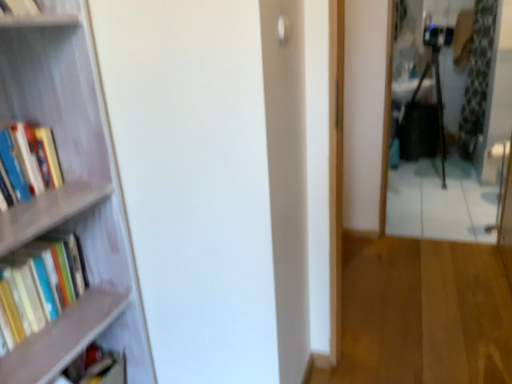
Question: From the image's perspective, is wooden bookshelf at left on top of hardcover books at left, which ranks as the 2th book in top-to-bottom order?

Choices:
 (A) yes
 (B) no

Answer: (A)

Question: Is wooden bookshelf at left facing towards hardcover books at left, which is the 2th book from bottom to top?

Choices:
 (A) no
 (B) yes

Answer: (B)

Question: Does wooden bookshelf at left have a larger size compared to hardcover books at left, which ranks as the 2th book in top-to-bottom order?

Choices:
 (A) no
 (B) yes

Answer: (B)

Question: Considering the relative sizes of wooden bookshelf at left and hardcover books at left, which ranks as the 2th book in top-to-bottom order, in the image provided, is wooden bookshelf at left wider than hardcover books at left, which ranks as the 2th book in top-to-bottom order,?

Choices:
 (A) yes
 (B) no

Answer: (A)

Question: Is wooden bookshelf at left far from hardcover books at left, which ranks as the 2th book in top-to-bottom order?

Choices:
 (A) yes
 (B) no

Answer: (B)

Question: Is wooden bookshelf at left shorter than hardcover books at left, which is the 2th book from bottom to top?

Choices:
 (A) yes
 (B) no

Answer: (B)

Question: Does metallic reflective mirror at right appear on the right side of wooden floor at center?

Choices:
 (A) no
 (B) yes

Answer: (B)

Question: Would you say metallic reflective mirror at right is a long distance from wooden floor at center?

Choices:
 (A) yes
 (B) no

Answer: (B)

Question: From the image's perspective, is metallic reflective mirror at right on top of wooden floor at center?

Choices:
 (A) yes
 (B) no

Answer: (A)

Question: Can you confirm if metallic reflective mirror at right is shorter than wooden floor at center?

Choices:
 (A) yes
 (B) no

Answer: (B)

Question: Is metallic reflective mirror at right bigger than wooden floor at center?

Choices:
 (A) no
 (B) yes

Answer: (A)

Question: Is the depth of metallic reflective mirror at right greater than that of wooden floor at center?

Choices:
 (A) no
 (B) yes

Answer: (B)

Question: From the image's perspective, is wooden floor at center located above green floral fabric curtain at right?

Choices:
 (A) yes
 (B) no

Answer: (B)